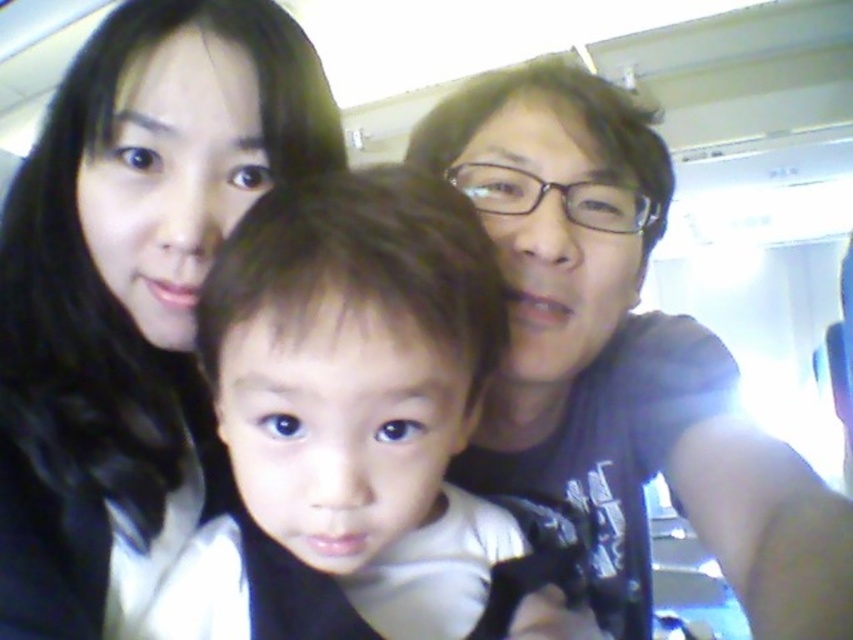
Looking at this image, who is more distant from viewer, [38,422] or [636,387]?

Point [636,387]

Can you confirm if black hair at upper left is positioned to the right of matte black shirt at upper right?

No, black hair at upper left is not to the right of matte black shirt at upper right.

At what (x,y) coordinates should I click in order to perform the action: click on black hair at upper left. Please return your answer as a coordinate pair (x, y). Image resolution: width=853 pixels, height=640 pixels. Looking at the image, I should click on (132, 296).

Describe the element at coordinates (132, 296) in the screenshot. This screenshot has width=853, height=640. I see `black hair at upper left` at that location.

Is point (15, 339) farther from viewer compared to point (296, 388)?

Yes, it is.

I want to click on black hair at upper left, so click(x=132, y=296).

Between smooth white shirt at center and matte black shirt at upper right, which one has more height?

matte black shirt at upper right is taller.

Looking at this image, who is positioned more to the right, smooth white shirt at center or matte black shirt at upper right?

matte black shirt at upper right

Is point (447, 387) more distant than point (607, 134)?

No, it is in front of (607, 134).

Where is `smooth white shirt at center`? smooth white shirt at center is located at coordinates (352, 424).